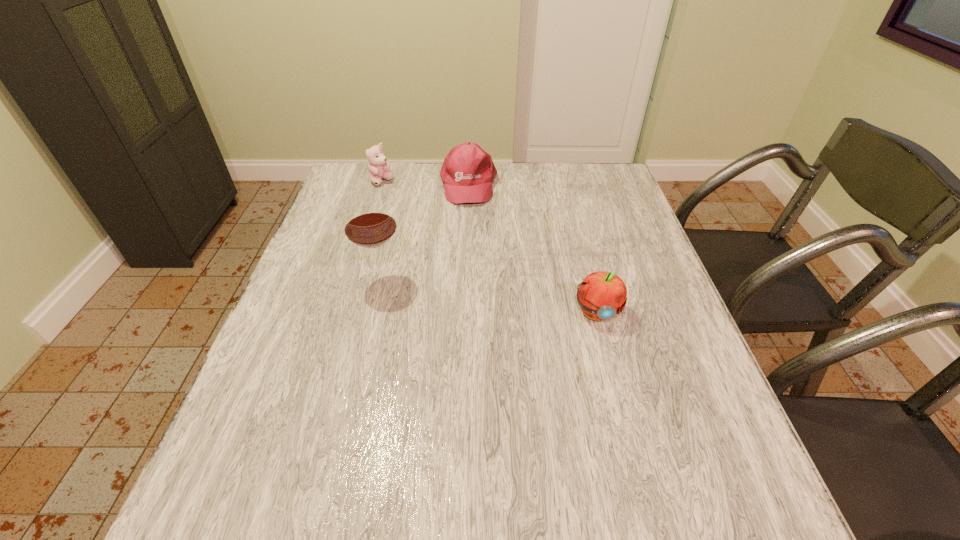
In the image, there is a desktop. Where is `free space at the left edge`? The image size is (960, 540). free space at the left edge is located at coordinates (316, 291).

This screenshot has height=540, width=960. Identify the location of vacant area at the right edge. (649, 300).

The image size is (960, 540). In the image, there is a desktop. Identify the location of vacant space at the far left corner. (x=367, y=167).

At what (x,y) coordinates should I click in order to perform the action: click on vacant position at the near right corner of the desktop. Please return your answer as a coordinate pair (x, y). Looking at the image, I should click on (655, 417).

You are a GUI agent. You are given a task and a screenshot of the screen. Output one action in this format:
    pyautogui.click(x=<x>, y=<y>)
    Task: Click on the blank region between the teddy bear and the third object from left to right
    The image size is (960, 540).
    Given the screenshot: What is the action you would take?
    click(425, 183)

Where is `free space between the teddy bear and the baseball cap`? The height and width of the screenshot is (540, 960). free space between the teddy bear and the baseball cap is located at coordinates (425, 183).

At what (x,y) coordinates should I click in order to perform the action: click on free area in between the second object from right to left and the wineglass. Please return your answer as a coordinate pair (x, y). Looking at the image, I should click on (425, 232).

Locate an element on the screen. empty location between the wineglass and the apple is located at coordinates (489, 296).

At what (x,y) coordinates should I click in order to perform the action: click on vacant space in between the teddy bear and the rightmost object. Please return your answer as a coordinate pair (x, y). Looking at the image, I should click on (489, 246).

I want to click on empty space between the teddy bear and the third object from left to right, so click(x=425, y=183).